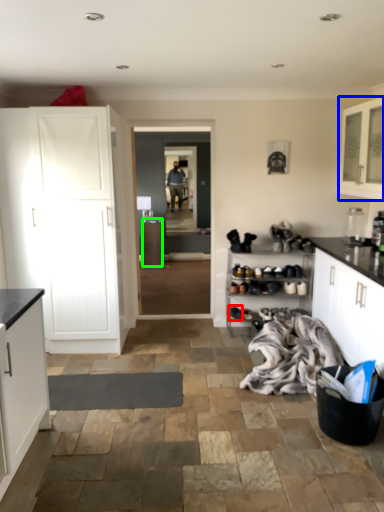
Question: Based on their relative distances, which object is farther from footwear (highlighted by a red box)? Choose from cabinetry (highlighted by a blue box) and cabinetry (highlighted by a green box).

Choices:
 (A) cabinetry
 (B) cabinetry

Answer: (B)